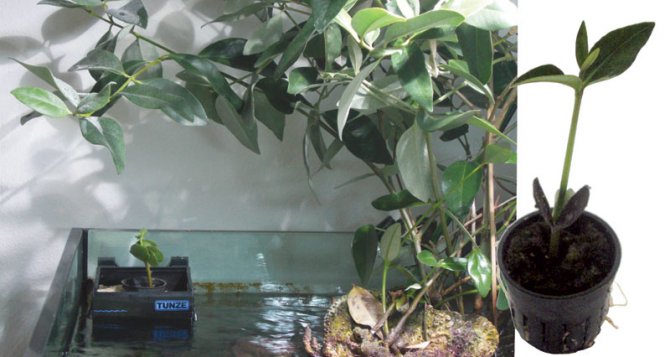
Identify the location of glass. click(218, 255), click(65, 310).